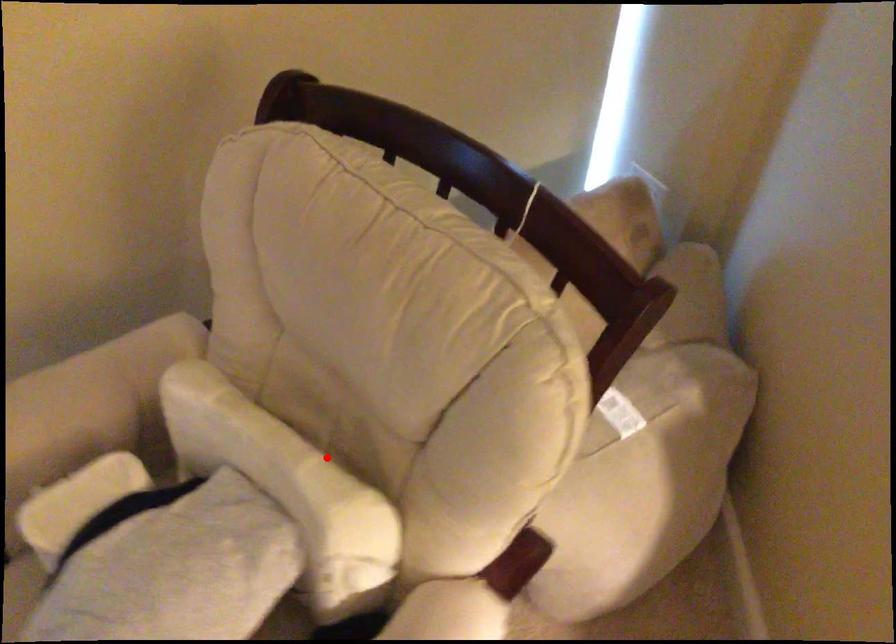
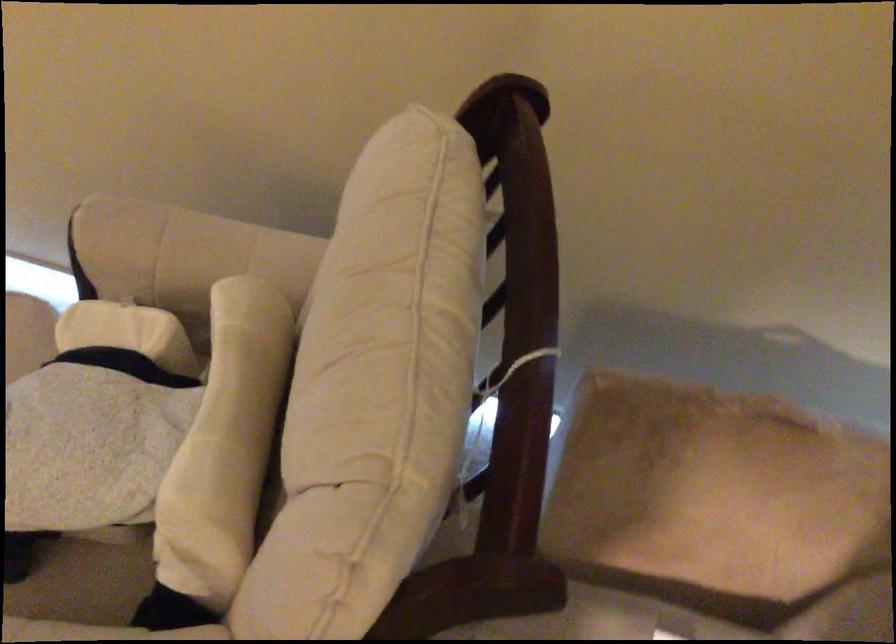
Where in the second image is the point corresponding to the highlighted location from the first image?

(225, 444)